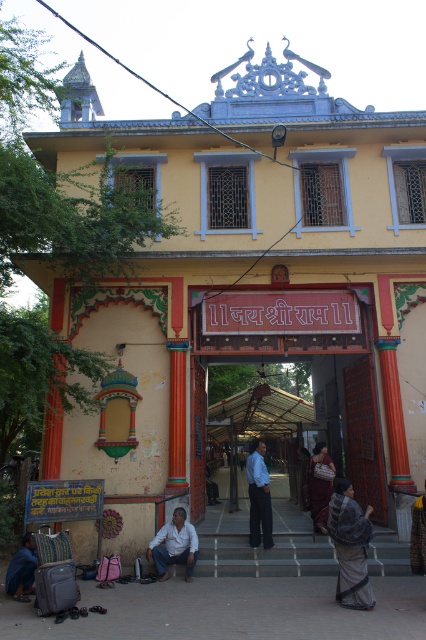
Question: Which of these objects is positioned closest to the blue fabric at lower left?

Choices:
 (A) dark gray textured shawl at lower right
 (B) maroon fabric saree at center

Answer: (A)

Question: Considering the real-world distances, which object is closest to the blue fabric at lower left?

Choices:
 (A) light blue shirt at center
 (B) maroon fabric saree at center
 (C) dark gray textured shawl at lower right

Answer: (A)

Question: Does light blue shirt at center appear under maroon fabric saree at center?

Choices:
 (A) yes
 (B) no

Answer: (A)

Question: Which point is farther to the camera?

Choices:
 (A) dark gray textured shawl at lower right
 (B) white cotton shirt at lower center

Answer: (B)

Question: Does dark gray textured shawl at lower right appear on the right side of white cotton shirt at lower center?

Choices:
 (A) yes
 (B) no

Answer: (A)

Question: Can you confirm if light blue shirt at center is positioned to the right of blue fabric at lower left?

Choices:
 (A) yes
 (B) no

Answer: (A)